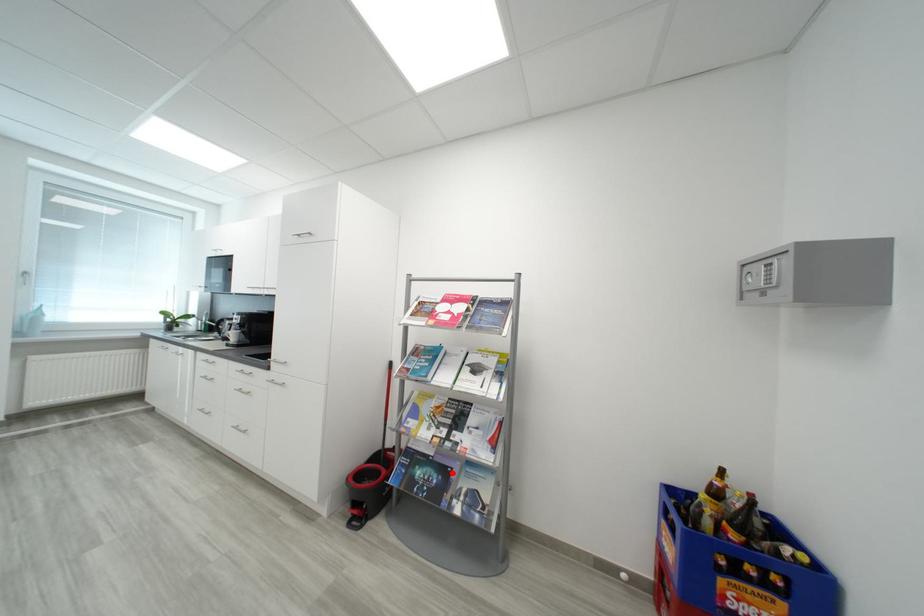
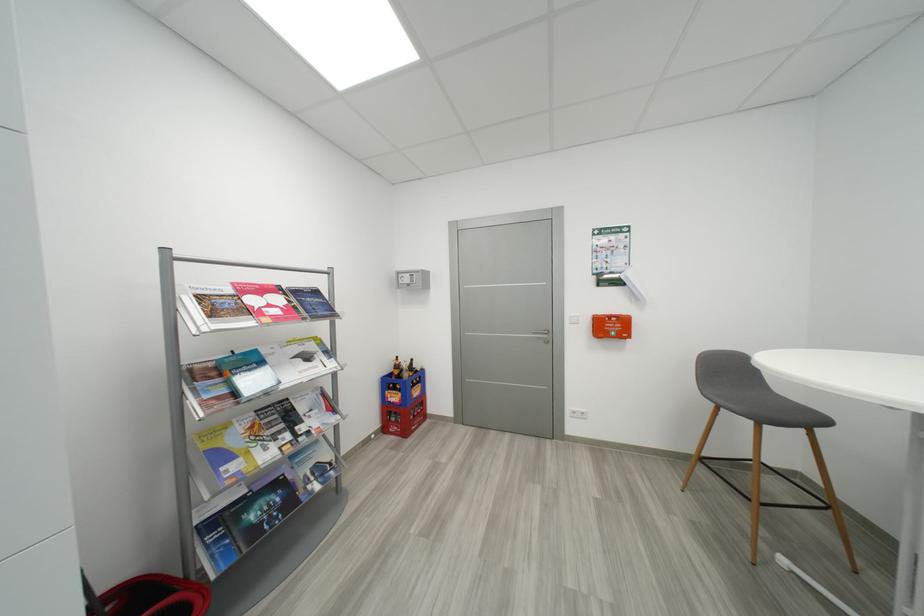
Question: I am providing you with two images of the same scene from different viewpoints. In image1, a red point is highlighted. Considering the same 3D point in image2, which of the following is correct?

Choices:
 (A) It is closer
 (B) It is farther

Answer: (A)